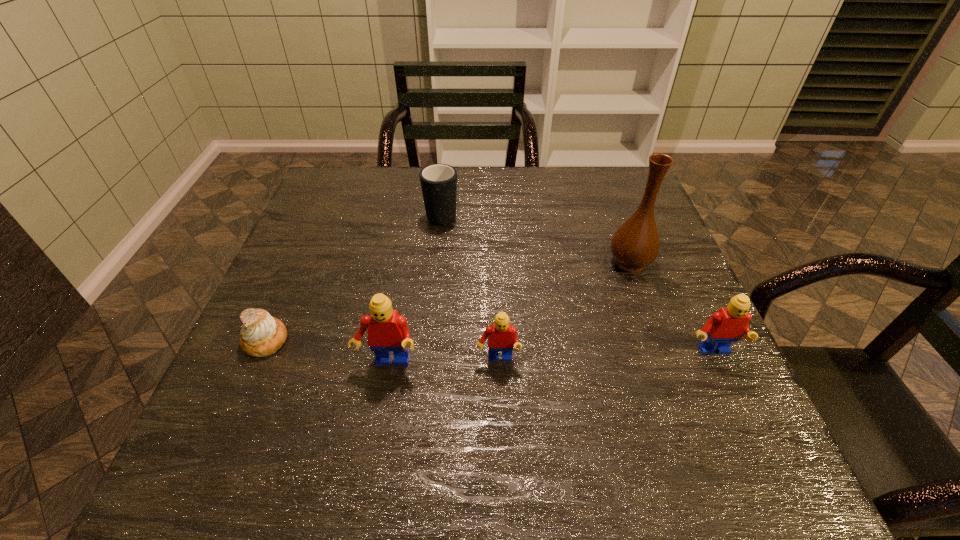
This screenshot has width=960, height=540. In order to click on unoccupied position between the rightmost Lego and the fifth nearest object in this screenshot , I will do `click(671, 307)`.

Locate an element on the screen. The width and height of the screenshot is (960, 540). free area in between the leftmost Lego and the second shortest Lego is located at coordinates (550, 358).

This screenshot has width=960, height=540. What are the coordinates of `vacant area that lies between the leftmost Lego and the tallest object` in the screenshot? It's located at [x=509, y=313].

Identify the location of free space between the leftmost Lego and the rightmost Lego. (550, 358).

Select which object appears as the second closest to the leftmost Lego. Please provide its 2D coordinates. Your answer should be formatted as a tuple, i.e. [(x, y)], where the tuple contains the x and y coordinates of a point satisfying the conditions above.

[(262, 335)]

Identify which object is the third closest to the second farthest object. Please provide its 2D coordinates. Your answer should be formatted as a tuple, i.e. [(x, y)], where the tuple contains the x and y coordinates of a point satisfying the conditions above.

[(438, 182)]

Select which Lego appears as the closest to the shortest Lego. Please provide its 2D coordinates. Your answer should be formatted as a tuple, i.e. [(x, y)], where the tuple contains the x and y coordinates of a point satisfying the conditions above.

[(388, 331)]

Find the location of `Lego that is the closest to the vase`. Lego that is the closest to the vase is located at coordinates (729, 324).